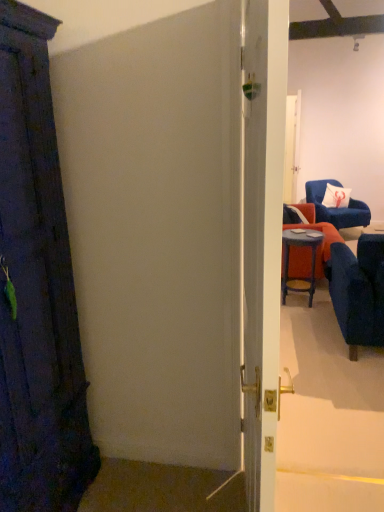
Question: Is velvet blue armchair at upper right, arranged as the 2th chair when ordered from the bottom, situated inside white fabric pillow at upper right or outside?

Choices:
 (A) outside
 (B) inside

Answer: (A)

Question: From the image's perspective, is velvet blue armchair at upper right, arranged as the 2th chair when ordered from the bottom, positioned above or below white fabric pillow at upper right?

Choices:
 (A) below
 (B) above

Answer: (A)

Question: Which of these objects is positioned farthest from the velvet blue armchair at right, which ranks as the first chair in front-to-back order?

Choices:
 (A) white glossy door at center
 (B) white fabric pillow at upper right
 (C) velvet blue armchair at upper right, arranged as the 2th chair when ordered from the bottom
 (D) matte blue stool at right

Answer: (A)

Question: Estimate the real-world distances between objects in this image. Which object is closer to the matte blue stool at right?

Choices:
 (A) white glossy door at center
 (B) velvet blue armchair at right, which is the 2th chair in back-to-front order
 (C) velvet blue armchair at upper right, the second chair from the front
 (D) white fabric pillow at upper right

Answer: (C)